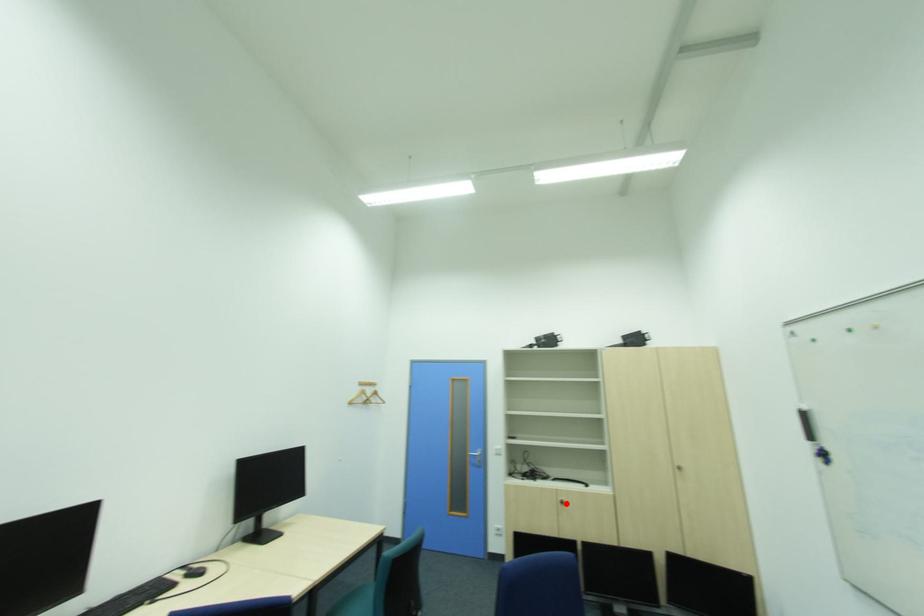
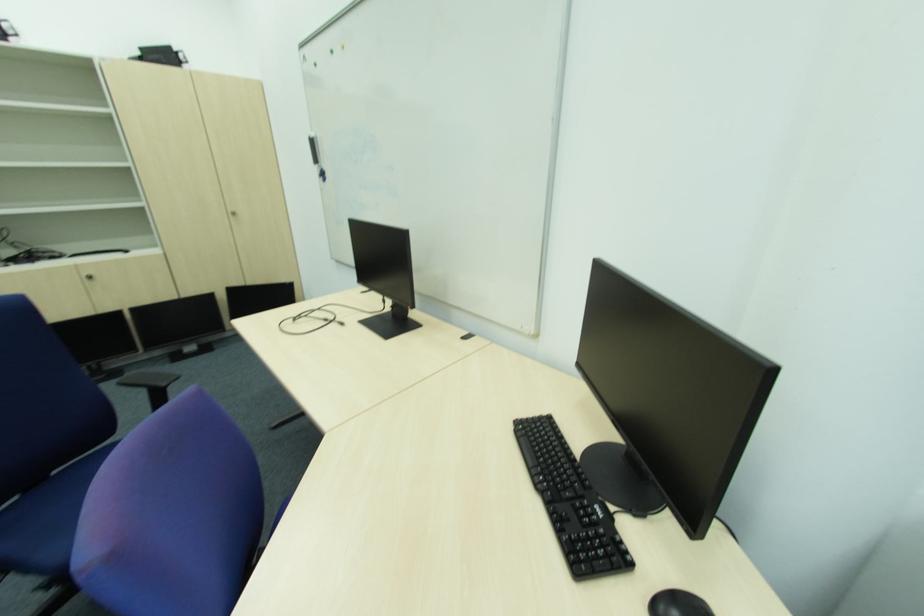
Locate, in the second image, the point that corresponds to the highlighted location in the first image.

(92, 280)